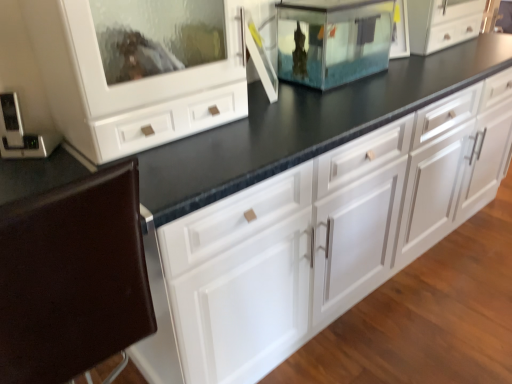
Question: Is the depth of transparent glass fish tank at center, the 2th appliance when ordered from left to right, greater than that of white glossy cabinet at center?

Choices:
 (A) yes
 (B) no

Answer: (A)

Question: Can you confirm if transparent glass fish tank at center, the 1th appliance viewed from the back, is thinner than white glossy cabinet at center?

Choices:
 (A) yes
 (B) no

Answer: (A)

Question: Is white glossy cabinet at center at the back of transparent glass fish tank at center, which ranks as the second appliance in bottom-to-top order?

Choices:
 (A) no
 (B) yes

Answer: (A)

Question: From the image's perspective, would you say transparent glass fish tank at center, which ranks as the second appliance in bottom-to-top order, is shown under white glossy cabinet at center?

Choices:
 (A) yes
 (B) no

Answer: (B)

Question: Can you confirm if transparent glass fish tank at center, the 1th appliance viewed from the back, is positioned to the left of white glossy cabinet at center?

Choices:
 (A) no
 (B) yes

Answer: (B)

Question: Is transparent glass fish tank at center, arranged as the 1th appliance when viewed from the right, located outside white glossy cabinet at center?

Choices:
 (A) yes
 (B) no

Answer: (A)

Question: Does metallic silver thermostat at left, the 1th appliance in the front-to-back sequence, come behind transparent glass fish tank at center, which ranks as the second appliance in bottom-to-top order?

Choices:
 (A) yes
 (B) no

Answer: (B)

Question: Does metallic silver thermostat at left, the second appliance viewed from the top, have a greater height compared to transparent glass fish tank at center, acting as the 2th appliance starting from the front?

Choices:
 (A) no
 (B) yes

Answer: (A)

Question: From the image's perspective, does metallic silver thermostat at left, the second appliance viewed from the top, appear higher than transparent glass fish tank at center, the 2th appliance when ordered from left to right?

Choices:
 (A) no
 (B) yes

Answer: (A)

Question: Is metallic silver thermostat at left, the second appliance in the back-to-front sequence, to the left of transparent glass fish tank at center, the 1th appliance viewed from the back, from the viewer's perspective?

Choices:
 (A) no
 (B) yes

Answer: (B)

Question: Considering the relative sizes of metallic silver thermostat at left, the second appliance in the back-to-front sequence, and transparent glass fish tank at center, acting as the 2th appliance starting from the front, in the image provided, is metallic silver thermostat at left, the second appliance in the back-to-front sequence, smaller than transparent glass fish tank at center, acting as the 2th appliance starting from the front,?

Choices:
 (A) no
 (B) yes

Answer: (B)

Question: From a real-world perspective, is metallic silver thermostat at left, marked as the 2th appliance in a right-to-left arrangement, physically above transparent glass fish tank at center, which ranks as the first appliance in top-to-bottom order?

Choices:
 (A) yes
 (B) no

Answer: (B)

Question: From a real-world perspective, is brown leather chair at lower left positioned under metallic silver thermostat at left, which appears as the 1th appliance when ordered from the bottom, based on gravity?

Choices:
 (A) no
 (B) yes

Answer: (B)